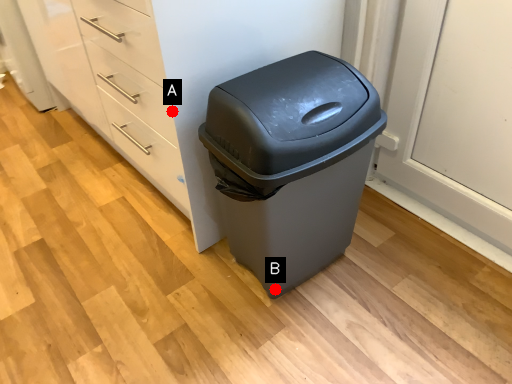
Question: Two points are circled on the image, labeled by A and B beside each circle. Which of the following is the farthest from the observer?

Choices:
 (A) A is further
 (B) B is further

Answer: (B)